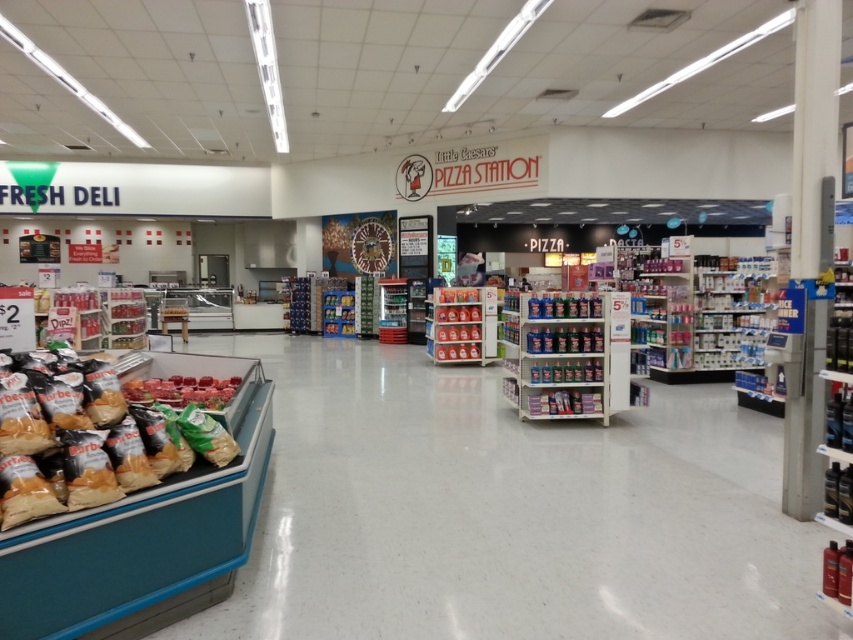
Question: Does matte plastic soda bottles at center appear on the left side of shiny red meat at center?

Choices:
 (A) no
 (B) yes

Answer: (A)

Question: Observing the image, what is the correct spatial positioning of matte plastic soda bottles at center in reference to shiny red meat at center?

Choices:
 (A) right
 (B) left

Answer: (A)

Question: Which of the following is the closest to the observer?

Choices:
 (A) (132, 388)
 (B) (448, 320)

Answer: (A)

Question: Estimate the real-world distances between objects in this image. Which object is closer to the matte plastic soda bottles at center?

Choices:
 (A) shiny red meat at center
 (B) golden brown chips at lower left

Answer: (A)

Question: Which of the following is the farthest from the observer?

Choices:
 (A) (13, 429)
 (B) (219, 388)

Answer: (B)

Question: Can you confirm if matte plastic soda bottles at center is positioned to the right of shiny red meat at center?

Choices:
 (A) no
 (B) yes

Answer: (B)